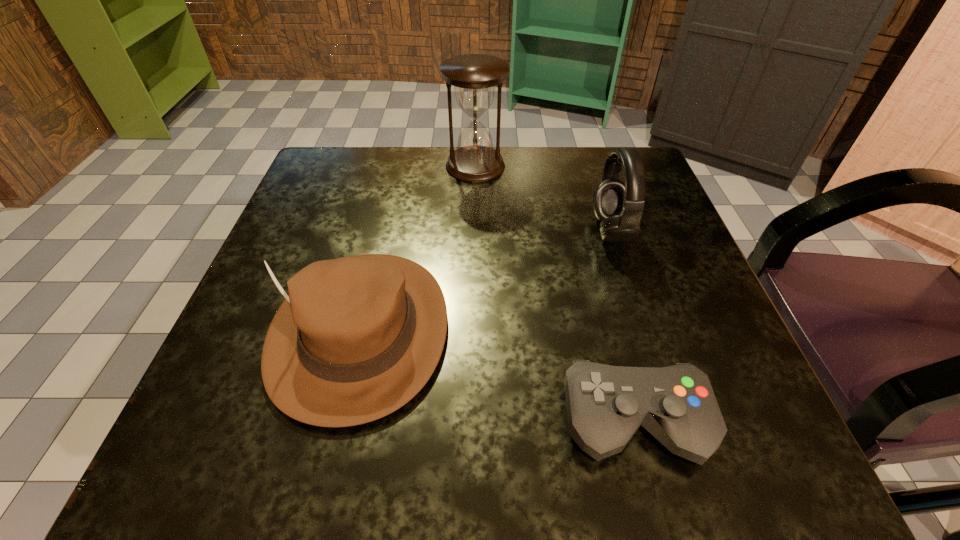
At what (x,y) coordinates should I click in order to perform the action: click on free space between the hourglass and the shortest object. Please return your answer as a coordinate pair (x, y). Looking at the image, I should click on (555, 294).

The width and height of the screenshot is (960, 540). I want to click on unoccupied position between the tallest object and the control, so click(555, 294).

Where is `empty space between the control and the hourglass`? empty space between the control and the hourglass is located at coordinates (555, 294).

Locate an element on the screen. free space between the tallest object and the fedora is located at coordinates (418, 248).

I want to click on vacant space in between the shortest object and the fedora, so click(497, 376).

Image resolution: width=960 pixels, height=540 pixels. Identify the location of empty space that is in between the headset and the fedora. (485, 281).

Image resolution: width=960 pixels, height=540 pixels. What are the coordinates of `unoccupied area between the hourglass and the shortest object` in the screenshot? It's located at (555, 294).

The image size is (960, 540). Identify the location of object that stands as the second closest to the shortest object. (619, 206).

Point out which object is positioned as the nearest to the headset. Please provide its 2D coordinates. Your answer should be formatted as a tuple, i.e. [(x, y)], where the tuple contains the x and y coordinates of a point satisfying the conditions above.

[(474, 76)]

Where is `free location that satisfies the following two spatial constraints: 1. on the earcups of the headset; 2. on the feather side of the fedora`? free location that satisfies the following two spatial constraints: 1. on the earcups of the headset; 2. on the feather side of the fedora is located at coordinates (642, 331).